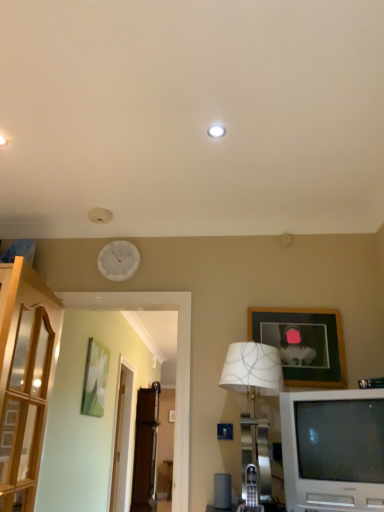
Question: Is white plastic television at lower right wider than white glossy clock at upper center?

Choices:
 (A) yes
 (B) no

Answer: (A)

Question: Can you confirm if white plastic television at lower right is bigger than white glossy clock at upper center?

Choices:
 (A) yes
 (B) no

Answer: (A)

Question: Does white plastic television at lower right appear on the left side of white glossy clock at upper center?

Choices:
 (A) yes
 (B) no

Answer: (B)

Question: Considering the relative sizes of white plastic television at lower right and white glossy clock at upper center in the image provided, is white plastic television at lower right taller than white glossy clock at upper center?

Choices:
 (A) no
 (B) yes

Answer: (B)

Question: From the image's perspective, does white plastic television at lower right appear lower than white glossy clock at upper center?

Choices:
 (A) yes
 (B) no

Answer: (A)

Question: Are white plastic television at lower right and white glossy clock at upper center making contact?

Choices:
 (A) yes
 (B) no

Answer: (B)

Question: Is wooden picture frame at upper right, positioned as the second picture frame in back-to-front order, located outside green matte painting at left, positioned as the 2th picture frame in front-to-back order?

Choices:
 (A) no
 (B) yes

Answer: (B)

Question: Is wooden picture frame at upper right, positioned as the second picture frame in back-to-front order, at the right side of green matte painting at left, which ranks as the first picture frame in left-to-right order?

Choices:
 (A) no
 (B) yes

Answer: (B)

Question: From the image's perspective, would you say wooden picture frame at upper right, the first picture frame viewed from the right, is shown under green matte painting at left, positioned as the first picture frame in bottom-to-top order?

Choices:
 (A) yes
 (B) no

Answer: (B)

Question: Considering the relative sizes of wooden picture frame at upper right, positioned as the second picture frame in back-to-front order, and green matte painting at left, positioned as the first picture frame in bottom-to-top order, in the image provided, is wooden picture frame at upper right, positioned as the second picture frame in back-to-front order, taller than green matte painting at left, positioned as the first picture frame in bottom-to-top order,?

Choices:
 (A) no
 (B) yes

Answer: (A)

Question: From the image's perspective, is wooden picture frame at upper right, positioned as the 2th picture frame in bottom-to-top order, above green matte painting at left, placed as the 2th picture frame when sorted from top to bottom?

Choices:
 (A) no
 (B) yes

Answer: (B)

Question: From a real-world perspective, is wooden picture frame at upper right, positioned as the second picture frame in back-to-front order, on green matte painting at left, the first picture frame positioned from the back?

Choices:
 (A) yes
 (B) no

Answer: (A)

Question: Is green matte painting at left, placed as the 2th picture frame when sorted from top to bottom, completely or partially inside white glossy clock at upper center?

Choices:
 (A) yes
 (B) no

Answer: (B)